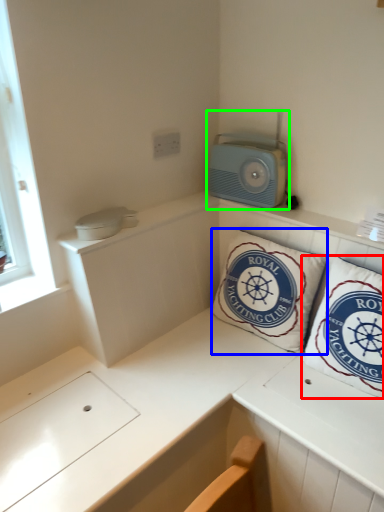
Question: Which object is positioned closest to pillow (highlighted by a red box)? Select from pillow (highlighted by a blue box) and appliance (highlighted by a green box).

Choices:
 (A) pillow
 (B) appliance

Answer: (A)